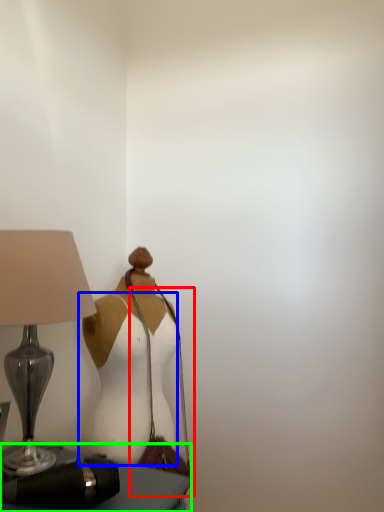
Question: Which is nearer to the shoulder bag (highlighted by a red box)? fancy dress (highlighted by a blue box) or furniture (highlighted by a green box).

Choices:
 (A) fancy dress
 (B) furniture

Answer: (A)